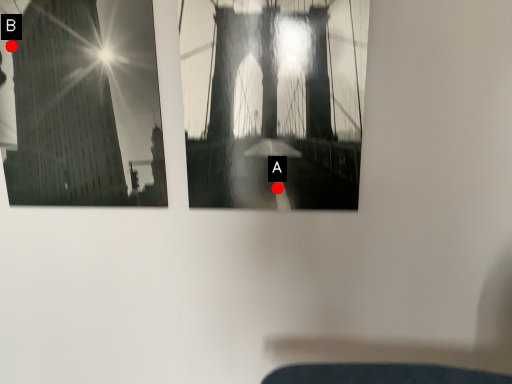
Question: Two points are circled on the image, labeled by A and B beside each circle. Which point appears farthest from the camera in this image?

Choices:
 (A) A is further
 (B) B is further

Answer: (A)